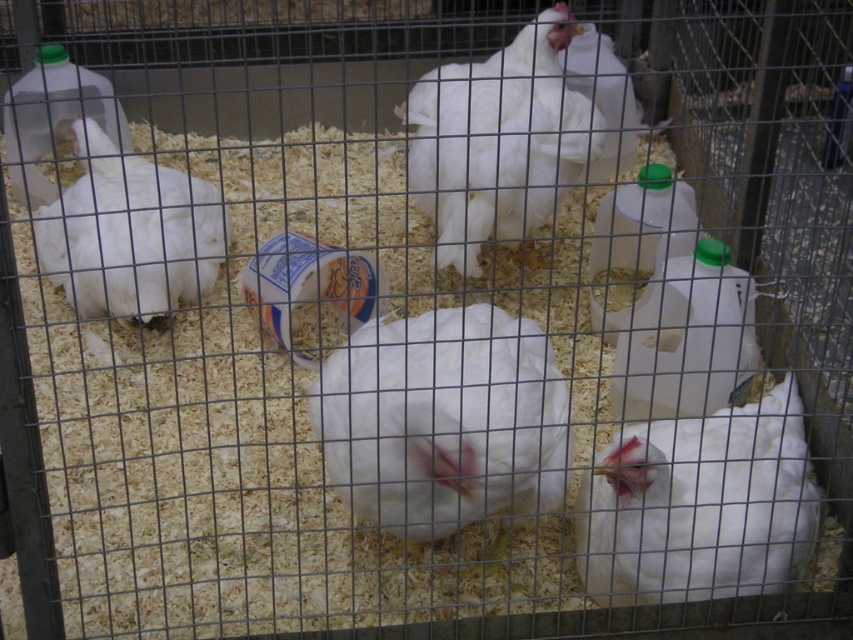
Is white feathered chicken at center smaller than green plastic bottle at center-right?

Indeed, white feathered chicken at center has a smaller size compared to green plastic bottle at center-right.

Is white feathered chicken at center bigger than green plastic bottle at center-right?

No.

Identify the location of white feathered chicken at center. (699, 506).

This screenshot has width=853, height=640. What are the coordinates of `white feathered chicken at center` in the screenshot? It's located at (699, 506).

Can you confirm if white fluffy chicken at center is shorter than green plastic bottle at center-right?

Incorrect, white fluffy chicken at center's height does not fall short of green plastic bottle at center-right's.

Can you confirm if white fluffy chicken at center is thinner than green plastic bottle at center-right?

No, white fluffy chicken at center is not thinner than green plastic bottle at center-right.

Who is more distant from viewer, (544, 96) or (668, 173)?

Positioned behind is point (668, 173).

Where is `white fluffy chicken at center`? white fluffy chicken at center is located at coordinates (497, 140).

Is point (788, 547) more distant than point (503, 145)?

No, (788, 547) is closer to viewer.

Is white feathered chicken at center smaller than white fluffy chicken at center?

Yes, white feathered chicken at center is smaller than white fluffy chicken at center.

Where is `white feathered chicken at center`? The width and height of the screenshot is (853, 640). white feathered chicken at center is located at coordinates (699, 506).